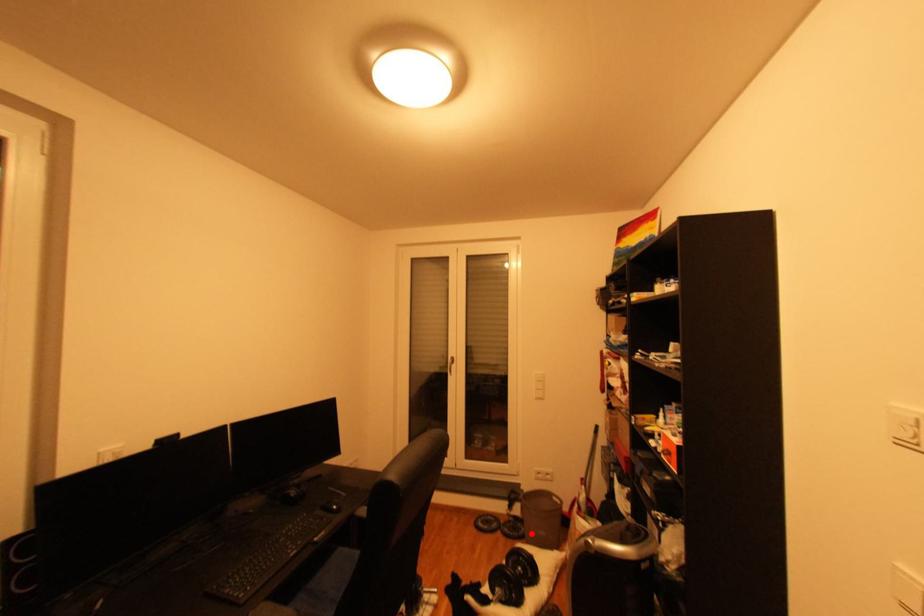
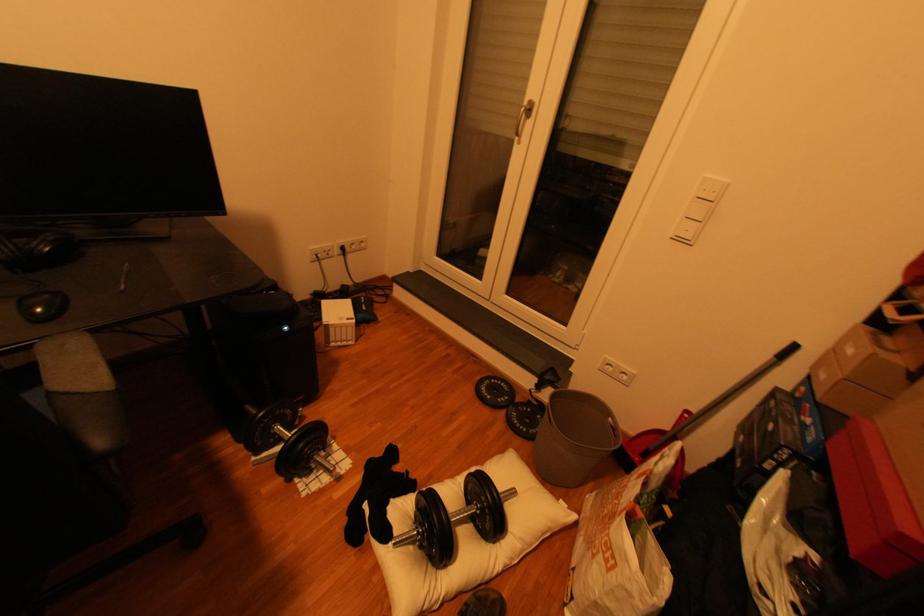
Question: I am providing you with two images of the same scene from different viewpoints. Given a red point in image1, look at the same physical point in image2. Is it:

Choices:
 (A) Closer to the viewpoint
 (B) Farther from the viewpoint

Answer: (A)